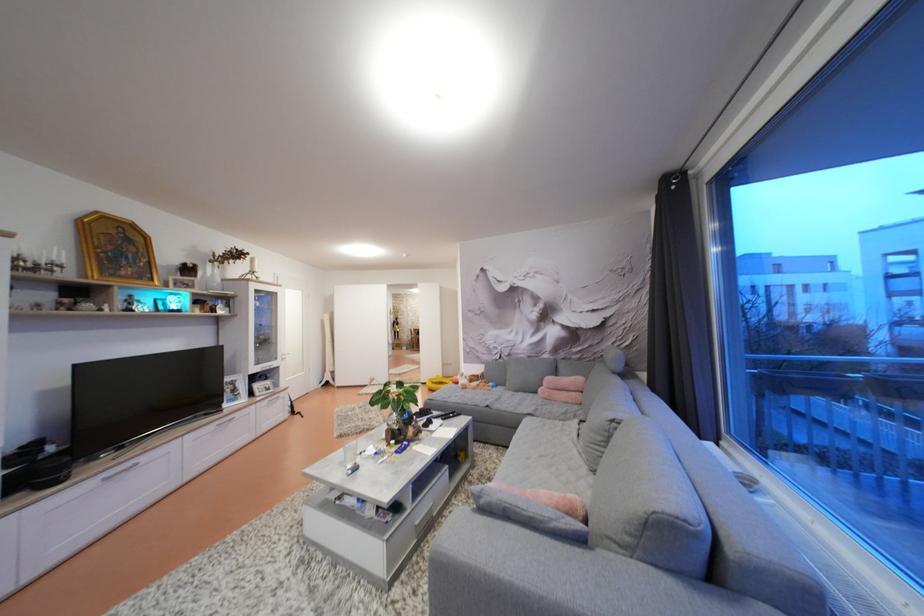
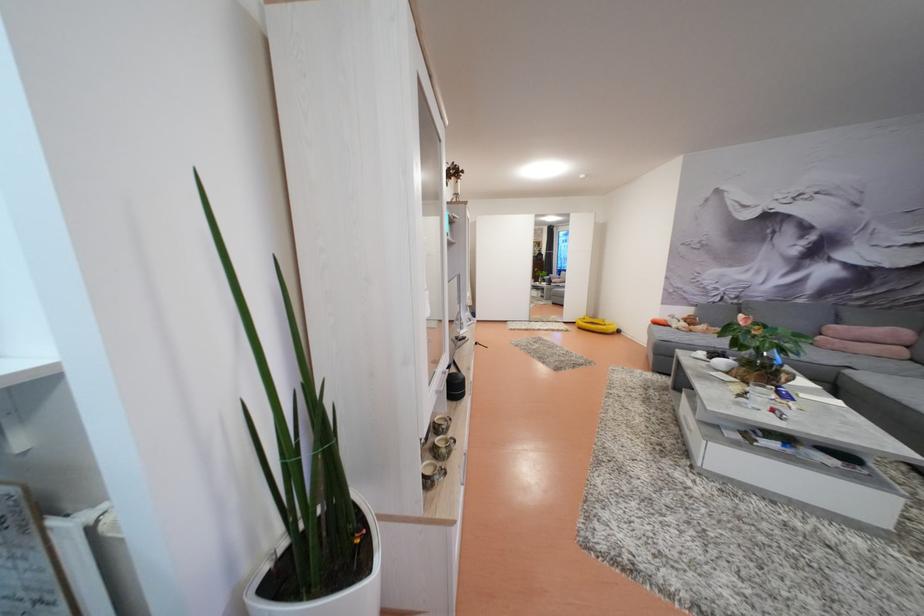
Find the pixel in the second image that matches the point at 556,384 in the first image.

(841, 333)